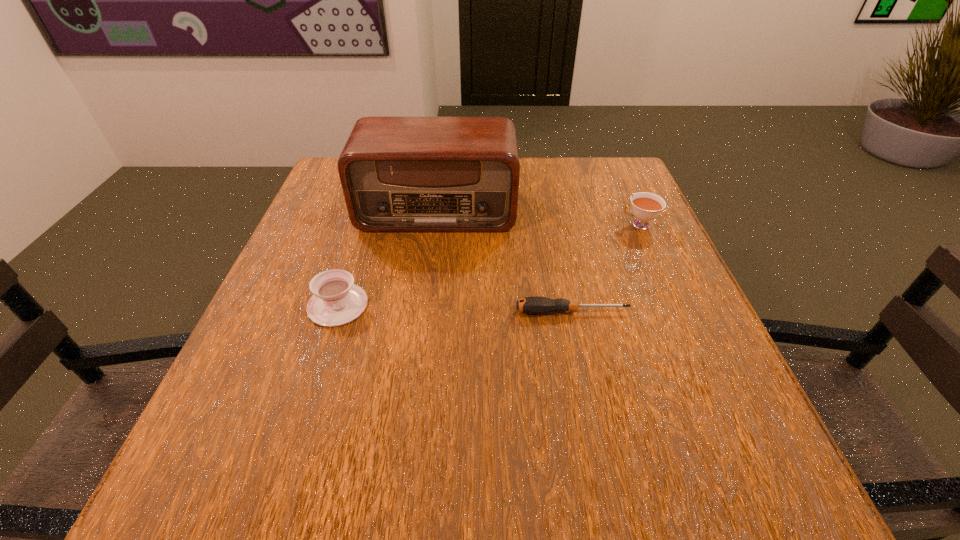
At what (x,y) coordinates should I click in order to perform the action: click on object present at the far edge. Please return your answer as a coordinate pair (x, y). Image resolution: width=960 pixels, height=540 pixels. Looking at the image, I should click on (399, 174).

Find the location of a particular element. The height and width of the screenshot is (540, 960). radio receiver at the left edge is located at coordinates (399, 174).

The height and width of the screenshot is (540, 960). I want to click on teacup positioned at the left edge, so click(x=336, y=301).

Image resolution: width=960 pixels, height=540 pixels. Find the location of `teacup present at the right edge`. teacup present at the right edge is located at coordinates [x=646, y=206].

This screenshot has width=960, height=540. In order to click on screwdriver that is positioned at the right edge in this screenshot , I will do `click(535, 305)`.

At what (x,y) coordinates should I click in order to perform the action: click on object that is at the far left corner. Please return your answer as a coordinate pair (x, y). The image size is (960, 540). Looking at the image, I should click on (399, 174).

Image resolution: width=960 pixels, height=540 pixels. What are the coordinates of `vacant space at the near edge of the desktop` in the screenshot? It's located at (537, 444).

Find the location of a particular element. vacant region at the left edge of the desktop is located at coordinates point(303,320).

The height and width of the screenshot is (540, 960). Identify the location of vacant space at the right edge. (658, 295).

At what (x,y) coordinates should I click in order to perform the action: click on free space at the far left corner of the desktop. Please return your answer as a coordinate pair (x, y). Image resolution: width=960 pixels, height=540 pixels. Looking at the image, I should click on (331, 168).